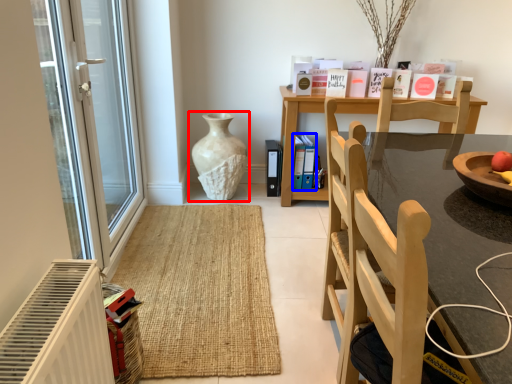
Question: Among these objects, which one is nearest to the camera, vase (highlighted by a red box) or book (highlighted by a blue box)?

Choices:
 (A) vase
 (B) book

Answer: (A)